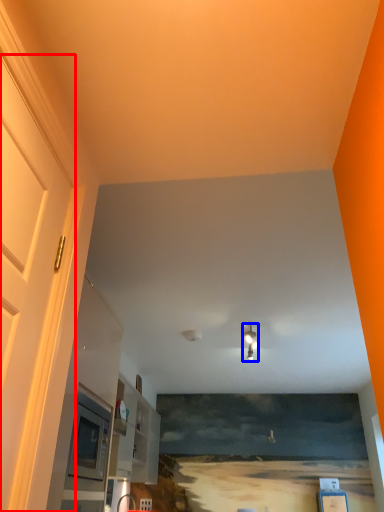
Question: Which point is further to the camera, door (highlighted by a red box) or light fixture (highlighted by a blue box)?

Choices:
 (A) door
 (B) light fixture

Answer: (B)